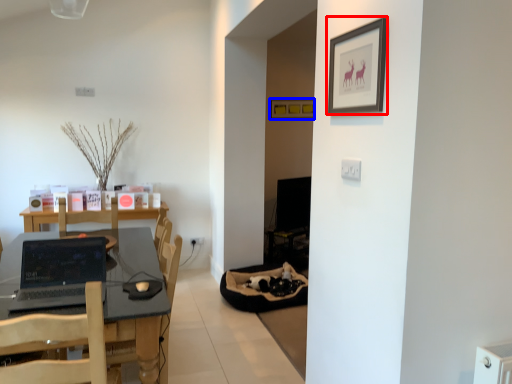
Question: Which object is closer to the camera taking this photo, picture frame (highlighted by a red box) or picture frame (highlighted by a blue box)?

Choices:
 (A) picture frame
 (B) picture frame

Answer: (A)